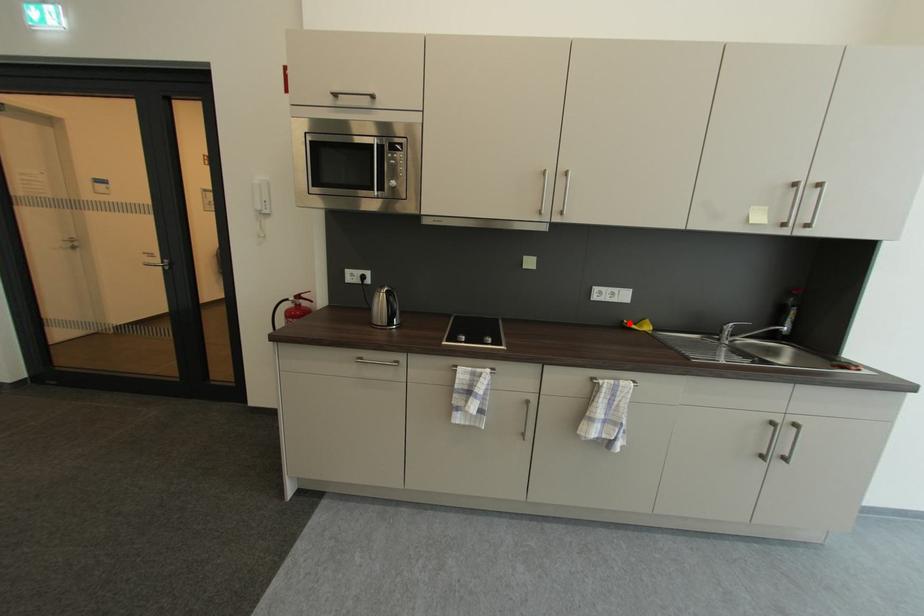
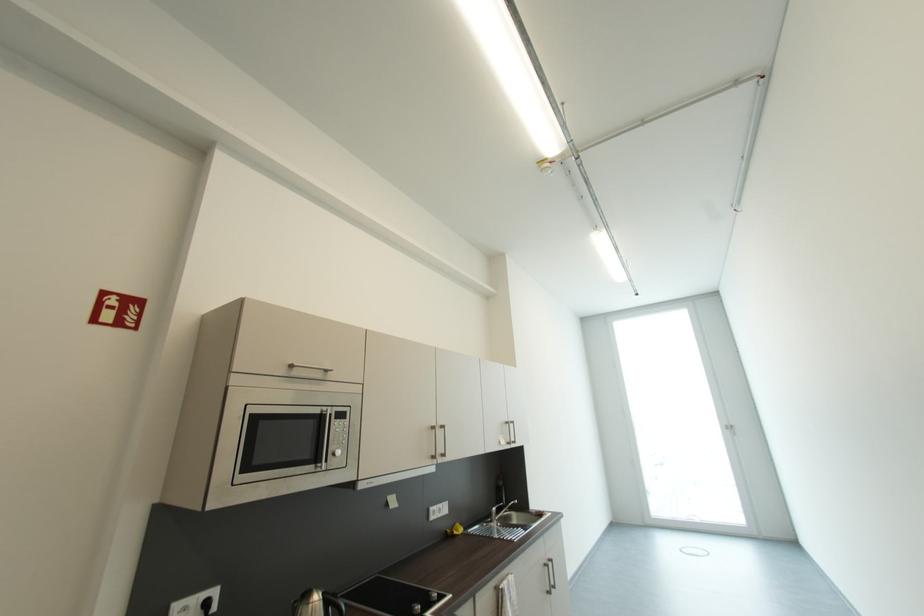
Question: I am providing you with two images of the same scene from different viewpoints. Given a red point in image1, look at the same physical point in image2. Is it:

Choices:
 (A) Closer to the viewpoint
 (B) Farther from the viewpoint

Answer: (B)